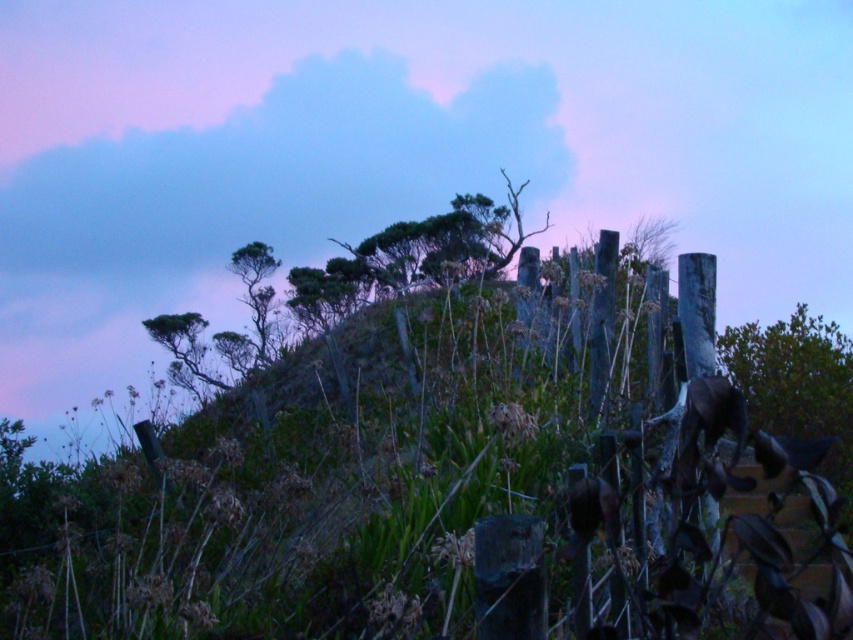
You are standing in a field and see the green matte tree at right and the green leafy tree at upper center. Which tree would you need to look up higher to see the top of?

The green leafy tree at upper center is taller than the green matte tree at right, so you would need to look up higher to see its top.

You are standing in front of the wooden fence and want to determine which tree is shorter. Based on the scene, can you identify the shorter tree between the green matte tree at right and the green leafy tree at center?

The green matte tree at right is shorter than the green leafy tree at center.